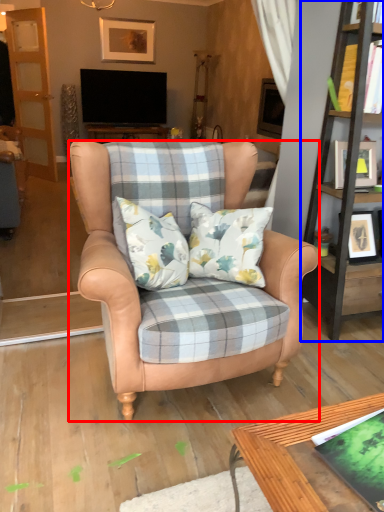
Question: Which point is further to the camera, chair (highlighted by a red box) or bookshelf (highlighted by a blue box)?

Choices:
 (A) chair
 (B) bookshelf

Answer: (B)